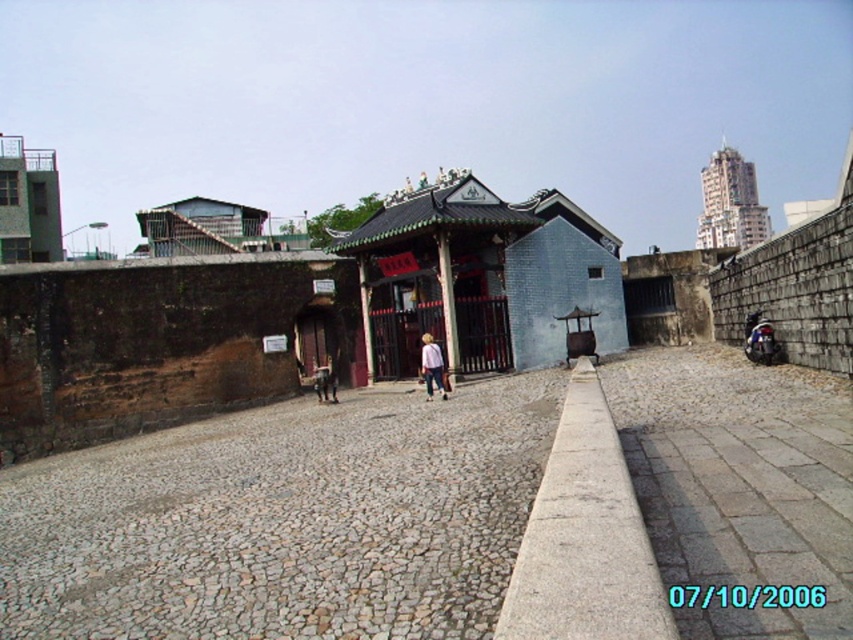
The image size is (853, 640). What do you see at coordinates (202, 227) in the screenshot?
I see `metallic gray hut at upper left` at bounding box center [202, 227].

Between point (213, 243) and point (442, 381), which one is positioned behind?

The point (213, 243) is more distant.

Identify the location of metallic gray hut at upper left. The width and height of the screenshot is (853, 640). (202, 227).

Is gray cobblestone alley at center closer to the viewer compared to green concrete building at upper left?

Yes, gray cobblestone alley at center is closer to the viewer.

Can you confirm if gray cobblestone alley at center is thinner than green concrete building at upper left?

Indeed, gray cobblestone alley at center has a lesser width compared to green concrete building at upper left.

Who is more forward, (57, 522) or (25, 237)?

Positioned in front is point (57, 522).

The height and width of the screenshot is (640, 853). I want to click on gray cobblestone alley at center, so click(283, 522).

Is point (419, 184) closer to camera compared to point (756, 326)?

That is False.

Is blue brick building at center to the right of shiny black motorcycle at right from the viewer's perspective?

Incorrect, blue brick building at center is not on the right side of shiny black motorcycle at right.

Describe the element at coordinates (480, 276) in the screenshot. I see `blue brick building at center` at that location.

Where is `blue brick building at center`? blue brick building at center is located at coordinates (480, 276).